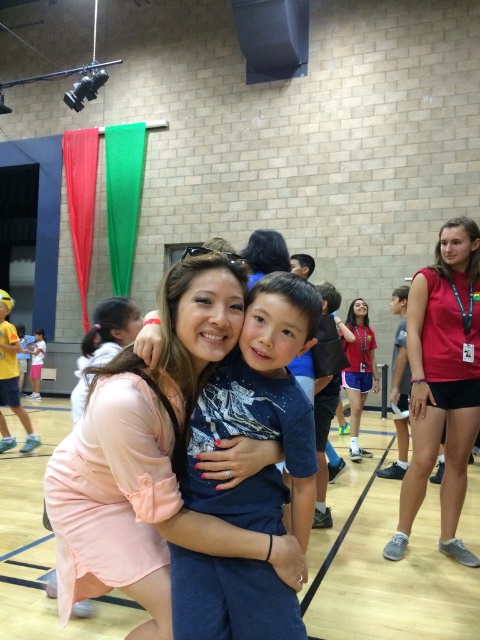
Based on the photo, which is more to the right, pink fabric dress at center or blue cotton shirt at center?

From the viewer's perspective, blue cotton shirt at center appears more on the right side.

Does pink fabric dress at center lie in front of blue cotton shirt at center?

Yes.

Identify the location of pink fabric dress at center. The height and width of the screenshot is (640, 480). (151, 458).

Where is `pink fabric dress at center`? This screenshot has width=480, height=640. pink fabric dress at center is located at coordinates (151, 458).

Is point (157, 433) positioned behind point (355, 353)?

No, (157, 433) is closer to viewer.

Measure the distance from pink fabric dress at center to red fabric shirt at center.

They are 11.89 feet apart.

Does point (187, 260) come farther from viewer compared to point (347, 349)?

No.

You are a GUI agent. You are given a task and a screenshot of the screen. Output one action in this format:
    pyautogui.click(x=<x>, y=<y>)
    Task: Click on the pink fabric dress at center
    
    Given the screenshot: What is the action you would take?
    pyautogui.click(x=151, y=458)

Does blue cotton shirt at center have a smaller size compared to light pink dress at center?

Yes, blue cotton shirt at center is smaller than light pink dress at center.

Between blue cotton shirt at center and light pink dress at center, which one appears on the left side from the viewer's perspective?

light pink dress at center

Identify the location of blue cotton shirt at center. The height and width of the screenshot is (640, 480). (261, 410).